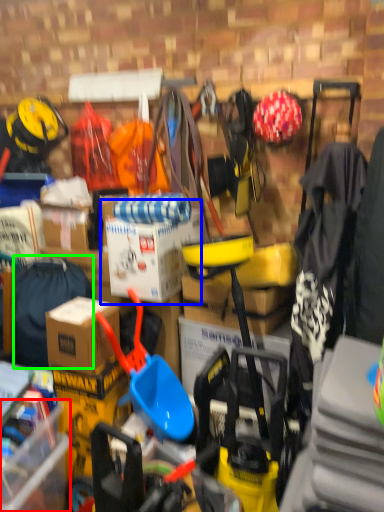
Question: Which object is the closest to the storage box (highlighted by a red box)? Choose among these: cardboard box (highlighted by a blue box) or clothing (highlighted by a green box).

Choices:
 (A) cardboard box
 (B) clothing

Answer: (B)